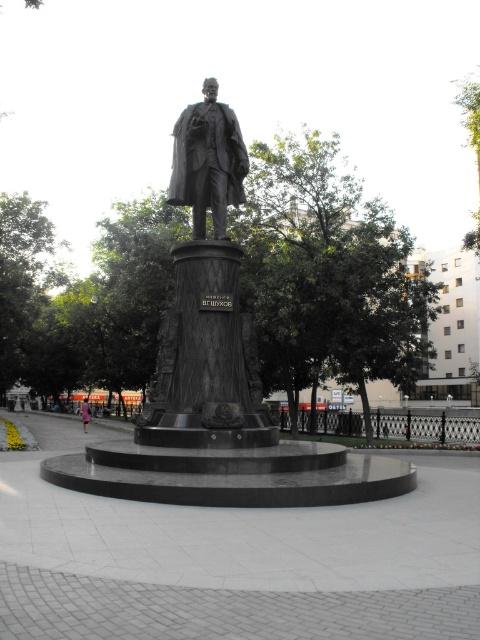
You are standing at the entrance of the public square and see the polished bronze statue at center. If you walk straight ahead, will you reach the statue before the curved wall?

Yes, the polished bronze statue at center is located at point 0.431, which is closer to the entrance than the curved wall. Therefore, walking straight ahead will lead you to the statue before reaching the curved wall.

Looking at this image, you are a photographer planning to take a photo of the polished bronze statue at center and the pink fabric dress at center. You want to ensure both are in focus. Given that your camera can only focus on objects within a 1.5 meter height range, will both objects fit within this range?

The polished bronze statue at center is smaller than the pink fabric dress at center. However, without specific height measurements, it is impossible to determine if their height difference falls within the 1.5 meter range. Additional information about their actual heights is needed to answer this question accurately.